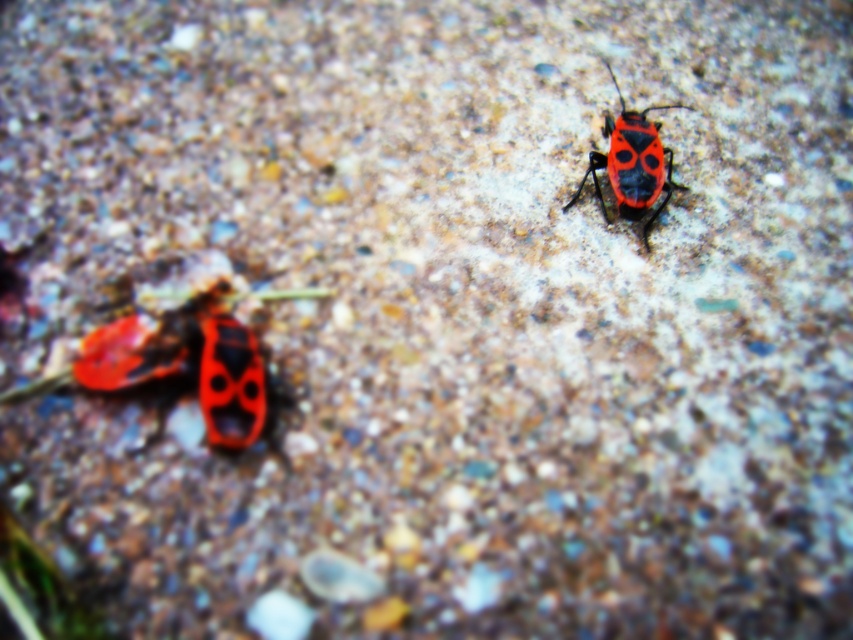
You are a photographer trying to capture the shiny red beetle at left and the shiny red beetle at upper right in a single frame. Which beetle should you adjust your camera focus to ensure the one that is more in focus appears clearer?

The shiny red beetle at upper right should be the focus because the shiny red beetle at left is slightly blurred, while the one on the right is more in focus.

You are holding a magnifying glass and want to examine the shiny red beetle at left closely. Considering its distance from you, can you estimate if it is within a comfortable viewing range for your magnifying glass which has a focal length of 12 inches?

The shiny red beetle at left is 38.96 inches away from the viewer, which is farther than the magnifying glass focal length of 12 inches. Therefore, it is outside the comfortable viewing range.